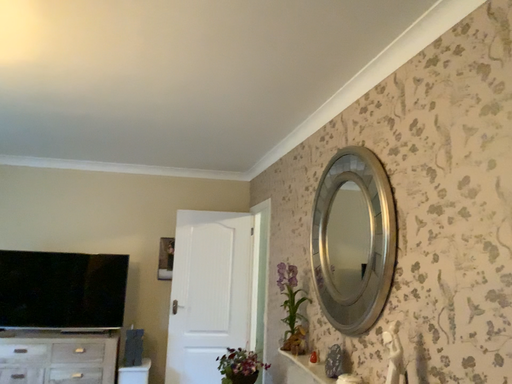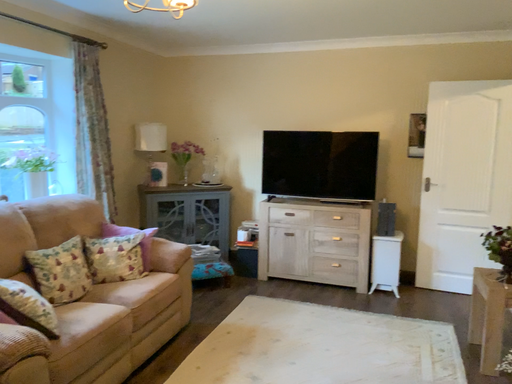
Question: Which way did the camera rotate in the video?

Choices:
 (A) rotated upward
 (B) rotated downward

Answer: (B)